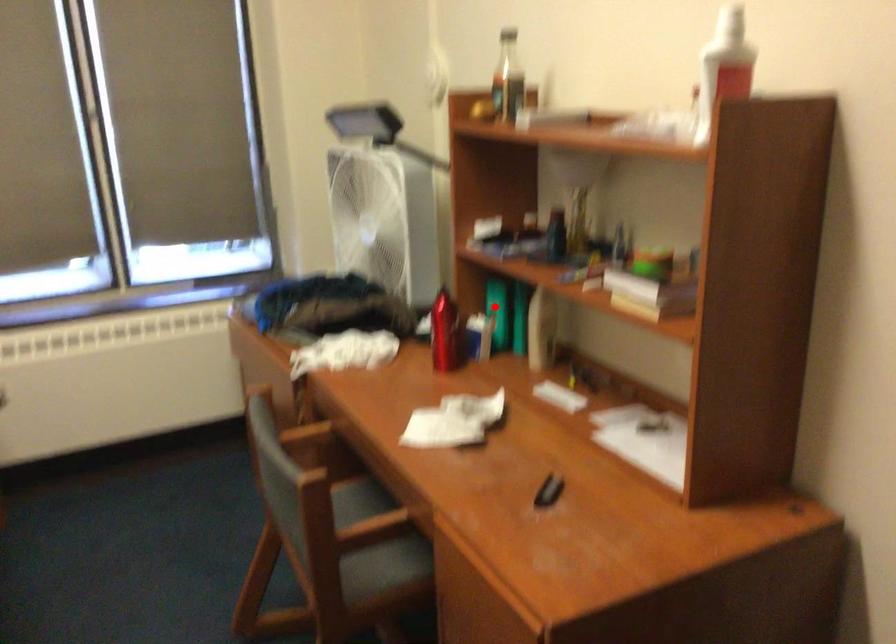
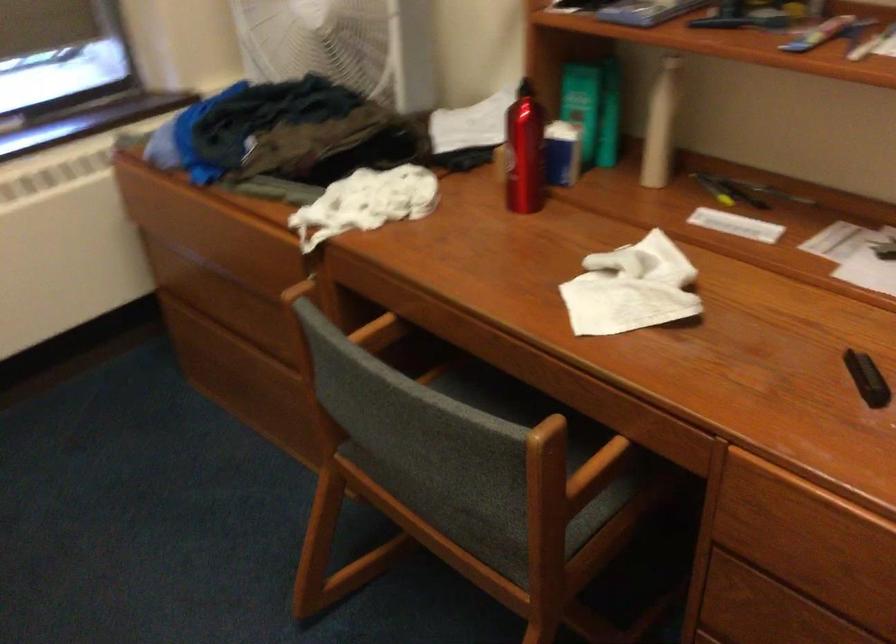
Find the pixel in the second image that matches the highlighted location in the first image.

(582, 104)